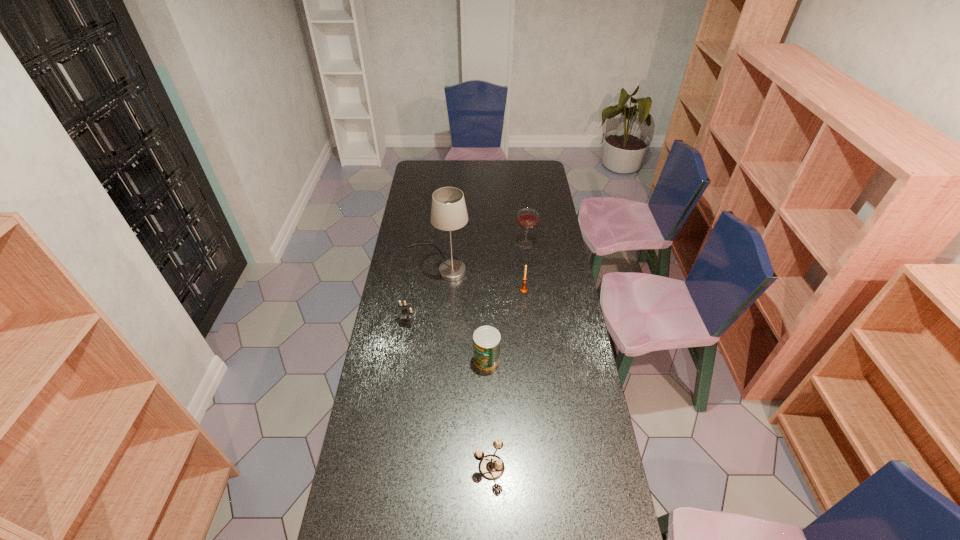
The width and height of the screenshot is (960, 540). Find the location of `vacant space at the far left corner`. vacant space at the far left corner is located at coordinates (428, 161).

This screenshot has width=960, height=540. Find the location of `free spot at the far right corner of the desktop`. free spot at the far right corner of the desktop is located at coordinates (539, 165).

This screenshot has height=540, width=960. I want to click on free space between the wineglass and the leftmost candle holder, so click(x=467, y=284).

This screenshot has height=540, width=960. Identify the location of blank region between the wineglass and the second nearest object. (506, 302).

This screenshot has width=960, height=540. In order to click on vacant region between the second farthest candle holder and the table lamp in this screenshot , I will do coord(422,293).

You are a GUI agent. You are given a task and a screenshot of the screen. Output one action in this format:
    pyautogui.click(x=<x>, y=<y>)
    Task: Click on the free space between the fifth shortest object and the nearest object
    
    Given the screenshot: What is the action you would take?
    pyautogui.click(x=508, y=356)

Locate an element on the screen. The height and width of the screenshot is (540, 960). free space that is in between the wineglass and the farthest candle holder is located at coordinates (524, 267).

Identify the location of vacant point located between the second candle holder from right to left and the table lamp. (464, 365).

In order to click on free space between the tallest object and the third farthest object in this screenshot , I will do `click(481, 276)`.

Locate an element on the screen. The height and width of the screenshot is (540, 960). vacant space that's between the tallest object and the third nearest object is located at coordinates click(422, 293).